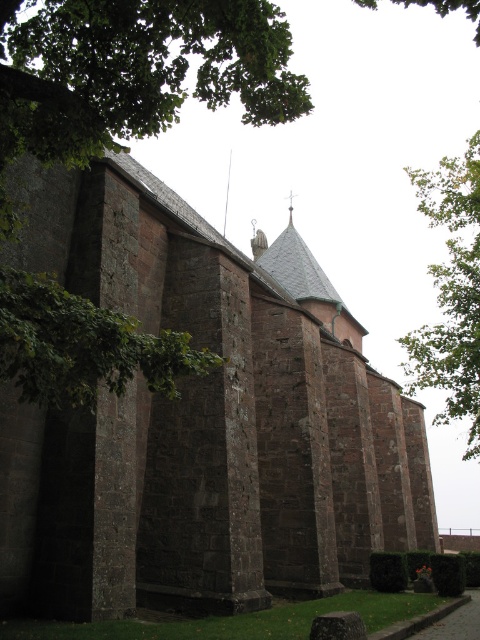
Is green leafy tree at upper left positioned before green leafy tree at upper right?

Yes.

Does point (86, 8) lie in front of point (467, 358)?

Yes.

Locate an element on the screen. green leafy tree at upper left is located at coordinates (134, 68).

Does point (112, 442) lie in front of point (130, 120)?

No, (112, 442) is behind (130, 120).

Does brown stone church at center have a greater width compared to green leafy tree at upper left?

Indeed, brown stone church at center has a greater width compared to green leafy tree at upper left.

Does point (216, 592) come closer to viewer compared to point (72, 52)?

No, it is behind (72, 52).

The height and width of the screenshot is (640, 480). I want to click on brown stone church at center, so click(x=201, y=420).

Can you confirm if brown stone church at center is bigger than green leafy tree at upper right?

Actually, brown stone church at center might be smaller than green leafy tree at upper right.

Can you confirm if brown stone church at center is positioned to the right of green leafy tree at upper right?

No, brown stone church at center is not to the right of green leafy tree at upper right.

The width and height of the screenshot is (480, 640). I want to click on brown stone church at center, so click(201, 420).

Locate an element on the screen. brown stone church at center is located at coordinates (201, 420).